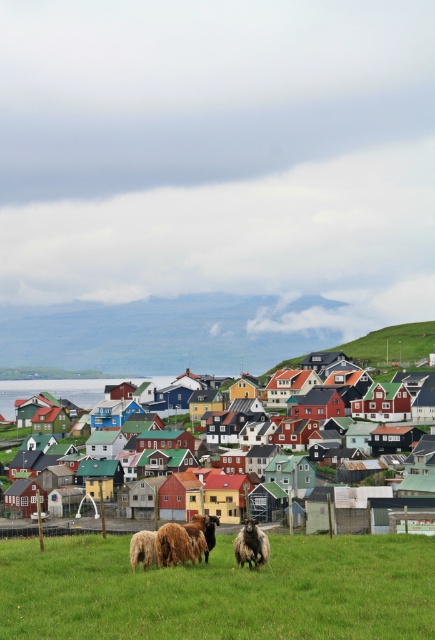
Which is below, green grassy hillside at upper right or white woolen sheep at lower center?

white woolen sheep at lower center is below.

Does green grassy hillside at upper right appear on the left side of white woolen sheep at lower center?

Incorrect, green grassy hillside at upper right is not on the left side of white woolen sheep at lower center.

The height and width of the screenshot is (640, 435). Identify the location of green grassy hillside at upper right. (391, 344).

Does green grassy hillside at upper right have a smaller size compared to multicolored wooden houses at center?

Yes, green grassy hillside at upper right is smaller than multicolored wooden houses at center.

Locate an element on the screen. The image size is (435, 640). green grassy hillside at upper right is located at coordinates (391, 344).

Does green grass at lower center appear under white woolen sheep at lower center?

No.

The height and width of the screenshot is (640, 435). In order to click on green grass at lower center in this screenshot , I will do `click(220, 589)`.

I want to click on green grass at lower center, so click(220, 589).